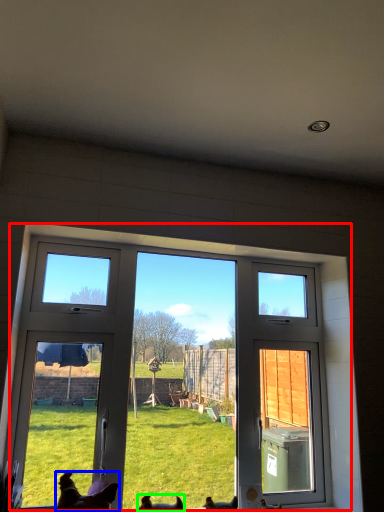
Question: Which object is positioned closest to window (highlighted by a red box)? Select from dog (highlighted by a blue box) and dog (highlighted by a green box).

Choices:
 (A) dog
 (B) dog

Answer: (A)